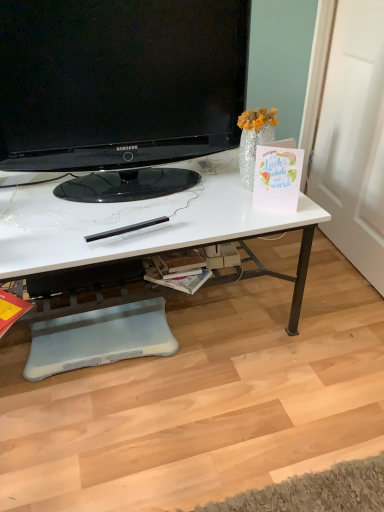
Question: Is white glossy desk at center to the left or to the right of matte yellow magazine at lower left, placed as the 2th magazine when sorted from right to left, in the image?

Choices:
 (A) left
 (B) right

Answer: (B)

Question: Is white glossy desk at center taller or shorter than matte yellow magazine at lower left, placed as the 2th magazine when sorted from right to left?

Choices:
 (A) short
 (B) tall

Answer: (B)

Question: Based on their relative distances, which object is nearer to the white glossy desk at center?

Choices:
 (A) black glossy television at upper center
 (B) matte yellow magazine at lower left, placed as the 2th magazine when sorted from right to left
 (C) white paper magazine at center, the 2th magazine from the left

Answer: (A)

Question: Which object is positioned farthest from the black glossy television at upper center?

Choices:
 (A) white paper magazine at center, acting as the 1th magazine starting from the right
 (B) matte yellow magazine at lower left, placed as the 2th magazine when sorted from right to left
 (C) white glossy desk at center

Answer: (B)